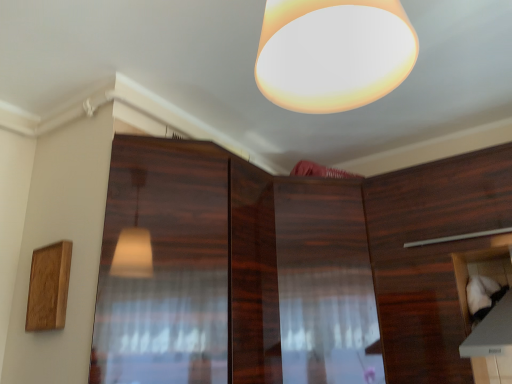
Question: Does wooden cabinet at right, which ranks as the second cabinetry in left-to-right order, have a smaller size compared to wooden cabinet at center, arranged as the 3th cabinetry when viewed from the right?

Choices:
 (A) no
 (B) yes

Answer: (B)

Question: Is wooden cabinet at right, which ranks as the second cabinetry in left-to-right order, behind wooden cabinet at center, which ranks as the 1th cabinetry in left-to-right order?

Choices:
 (A) yes
 (B) no

Answer: (B)

Question: Does wooden cabinet at right, which ranks as the second cabinetry in left-to-right order, appear on the left side of wooden cabinet at center, arranged as the 3th cabinetry when viewed from the right?

Choices:
 (A) yes
 (B) no

Answer: (B)

Question: From a real-world perspective, is wooden cabinet at right, which ranks as the second cabinetry in left-to-right order, under wooden cabinet at center, arranged as the 3th cabinetry when viewed from the right?

Choices:
 (A) yes
 (B) no

Answer: (B)

Question: Considering the relative sizes of wooden cabinet at right, which ranks as the second cabinetry in left-to-right order, and wooden cabinet at center, arranged as the 3th cabinetry when viewed from the right, in the image provided, is wooden cabinet at right, which ranks as the second cabinetry in left-to-right order, taller than wooden cabinet at center, arranged as the 3th cabinetry when viewed from the right,?

Choices:
 (A) yes
 (B) no

Answer: (B)

Question: Is white fabric at lower right, the 1th cabinetry from the right, in front of or behind glossy wood screen door at center in the image?

Choices:
 (A) behind
 (B) front

Answer: (A)

Question: Choose the correct answer: Is white fabric at lower right, arranged as the 3th cabinetry when viewed from the left, inside glossy wood screen door at center or outside it?

Choices:
 (A) outside
 (B) inside

Answer: (A)

Question: Is point (470, 261) closer or farther from the camera than point (209, 256)?

Choices:
 (A) farther
 (B) closer

Answer: (A)

Question: Looking at the image, does white fabric at lower right, the 1th cabinetry from the right, seem bigger or smaller compared to glossy wood screen door at center?

Choices:
 (A) big
 (B) small

Answer: (B)

Question: From their relative heights in the image, would you say wooden cabinet at right, which ranks as the second cabinetry in right-to-left order, is taller or shorter than matte white lampshade at upper center?

Choices:
 (A) tall
 (B) short

Answer: (A)

Question: Based on their positions, is wooden cabinet at right, which ranks as the second cabinetry in left-to-right order, located to the left or right of matte white lampshade at upper center?

Choices:
 (A) left
 (B) right

Answer: (B)

Question: Considering the positions of wooden cabinet at right, which ranks as the second cabinetry in right-to-left order, and matte white lampshade at upper center in the image, is wooden cabinet at right, which ranks as the second cabinetry in right-to-left order, wider or thinner than matte white lampshade at upper center?

Choices:
 (A) wide
 (B) thin

Answer: (A)

Question: Looking at the image, does wooden cabinet at right, which ranks as the second cabinetry in left-to-right order, seem bigger or smaller compared to matte white lampshade at upper center?

Choices:
 (A) big
 (B) small

Answer: (A)

Question: From a real-world perspective, is wooden cabinet at right, which ranks as the second cabinetry in left-to-right order, positioned above or below glossy wood screen door at center?

Choices:
 (A) above
 (B) below

Answer: (B)

Question: Considering the positions of wooden cabinet at right, which ranks as the second cabinetry in right-to-left order, and glossy wood screen door at center in the image, is wooden cabinet at right, which ranks as the second cabinetry in right-to-left order, taller or shorter than glossy wood screen door at center?

Choices:
 (A) tall
 (B) short

Answer: (A)